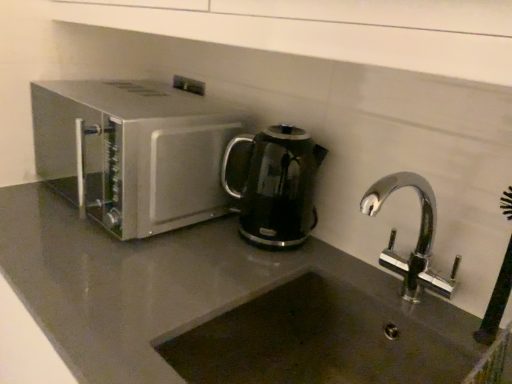
Question: Can you confirm if black glossy electric kettle at center is thinner than satin silver microwave at left?

Choices:
 (A) no
 (B) yes

Answer: (B)

Question: Considering the relative sizes of black glossy electric kettle at center and satin silver microwave at left in the image provided, is black glossy electric kettle at center smaller than satin silver microwave at left?

Choices:
 (A) no
 (B) yes

Answer: (B)

Question: Is the position of black glossy electric kettle at center more distant than that of satin silver microwave at left?

Choices:
 (A) yes
 (B) no

Answer: (A)

Question: Is black glossy electric kettle at center not within satin silver microwave at left?

Choices:
 (A) no
 (B) yes

Answer: (B)

Question: Considering the relative sizes of black glossy electric kettle at center and satin silver microwave at left in the image provided, is black glossy electric kettle at center taller than satin silver microwave at left?

Choices:
 (A) no
 (B) yes

Answer: (A)

Question: From a real-world perspective, does black glossy electric kettle at center sit lower than satin silver microwave at left?

Choices:
 (A) no
 (B) yes

Answer: (B)

Question: Is dark gray stone sink at lower center smaller than black glossy electric kettle at center?

Choices:
 (A) no
 (B) yes

Answer: (A)

Question: Is dark gray stone sink at lower center positioned behind black glossy electric kettle at center?

Choices:
 (A) yes
 (B) no

Answer: (B)

Question: From the image's perspective, is dark gray stone sink at lower center over black glossy electric kettle at center?

Choices:
 (A) no
 (B) yes

Answer: (A)

Question: Can you confirm if dark gray stone sink at lower center is positioned to the right of black glossy electric kettle at center?

Choices:
 (A) yes
 (B) no

Answer: (A)

Question: From a real-world perspective, is dark gray stone sink at lower center under black glossy electric kettle at center?

Choices:
 (A) yes
 (B) no

Answer: (A)

Question: Is black glossy electric kettle at center surrounded by dark gray stone sink at lower center?

Choices:
 (A) no
 (B) yes

Answer: (A)

Question: Is satin silver microwave at left shorter than dark gray stone sink at lower center?

Choices:
 (A) yes
 (B) no

Answer: (B)